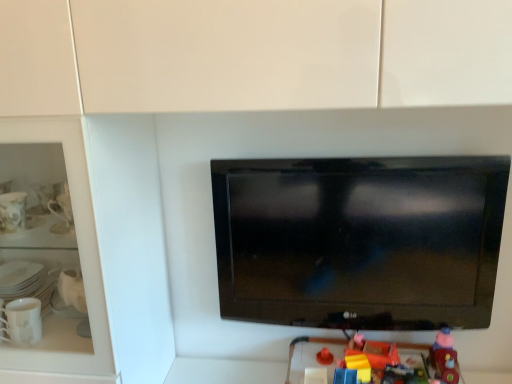
Where is `free space above rubberized plastic toy at lower right, acting as the 3th toy starting from the right (from a real-world perspective)`? This screenshot has height=384, width=512. free space above rubberized plastic toy at lower right, acting as the 3th toy starting from the right (from a real-world perspective) is located at coordinates (352, 377).